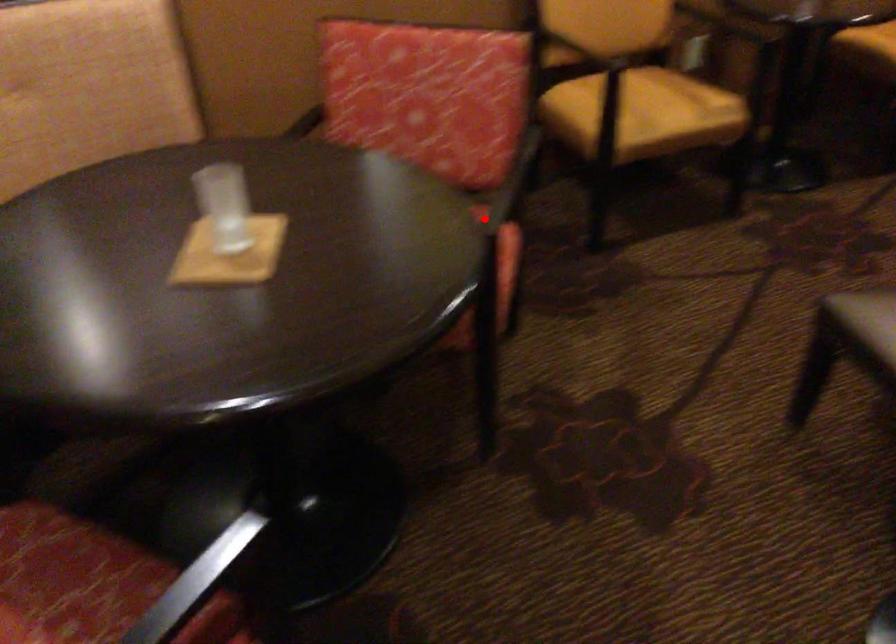
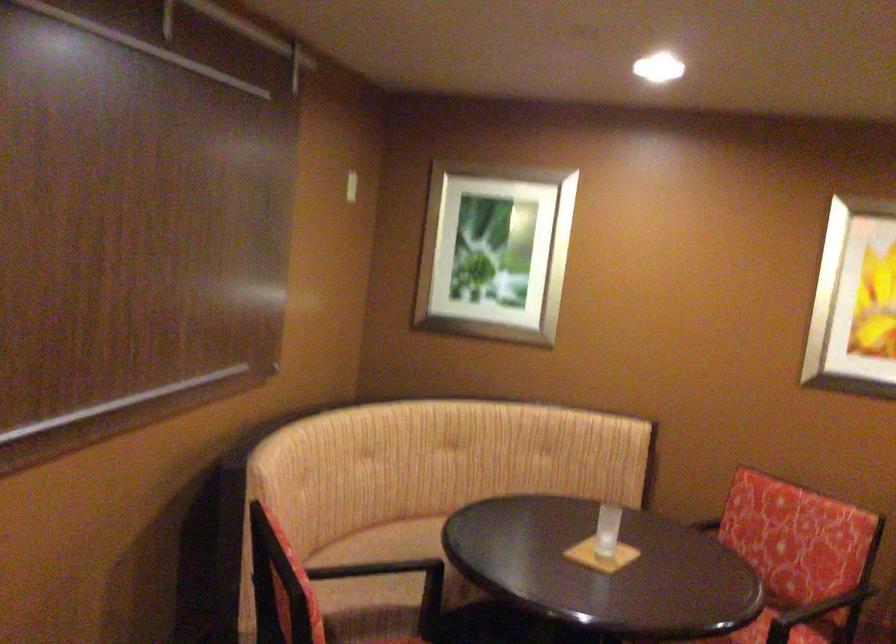
Question: I am providing you with two images of the same scene from different viewpoints. Given a red point in image1, look at the same physical point in image2. Is it:

Choices:
 (A) Closer to the viewpoint
 (B) Farther from the viewpoint

Answer: (B)